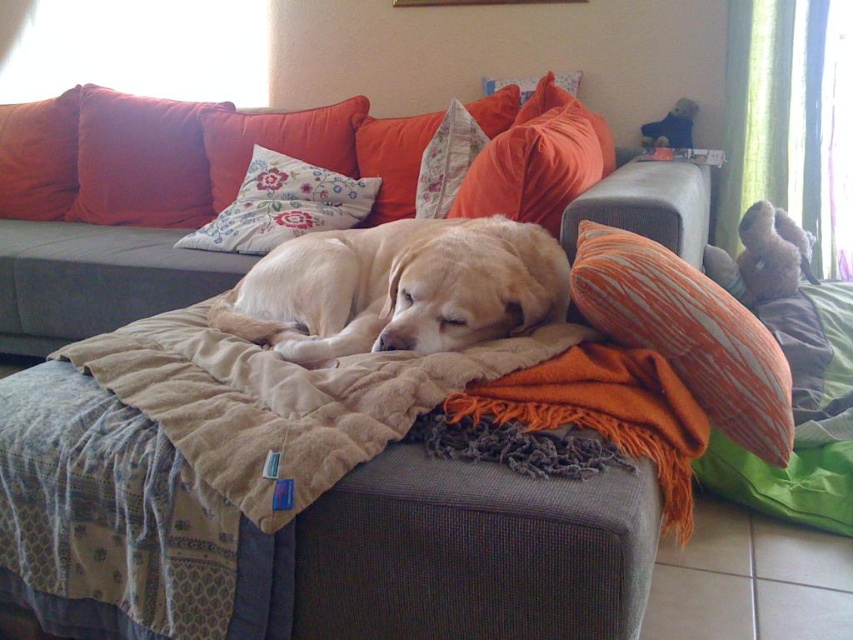
You are arranging a photo shoot and need to place a small decorative item on the pillow that is smaller in size. Which pillow should you choose between the orange fabric pillow at upper center and the floral fabric pillow at upper center?

The floral fabric pillow at upper center is smaller in size compared to the orange fabric pillow at upper center, so you should place the small decorative item on the floral fabric pillow at upper center.

You are arranging pillows for a photo shoot and need to place the orange fabric pillow at upper center and the floral fabric pillow at upper center. According to the scene, which pillow should be placed to the left of the other?

The orange fabric pillow at upper center should be placed to the right of the floral fabric pillow at upper center, so the floral fabric pillow at upper center is on the left side.